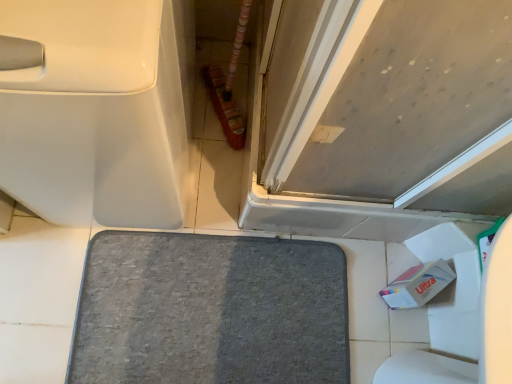
Question: Can you confirm if white glossy toilet at left is positioned to the right of gray soft carpet at center?

Choices:
 (A) yes
 (B) no

Answer: (B)

Question: Is white glossy toilet at left at the left side of gray soft carpet at center?

Choices:
 (A) yes
 (B) no

Answer: (A)

Question: Can you confirm if white glossy toilet at left is smaller than gray soft carpet at center?

Choices:
 (A) no
 (B) yes

Answer: (A)

Question: Considering the relative sizes of white glossy toilet at left and gray soft carpet at center in the image provided, is white glossy toilet at left shorter than gray soft carpet at center?

Choices:
 (A) yes
 (B) no

Answer: (B)

Question: Is white glossy toilet at left bigger than gray soft carpet at center?

Choices:
 (A) no
 (B) yes

Answer: (B)

Question: In terms of width, does gray soft carpet at center look wider or thinner when compared to matte gray door at upper right?

Choices:
 (A) wide
 (B) thin

Answer: (A)

Question: From a real-world perspective, is gray soft carpet at center physically located above or below matte gray door at upper right?

Choices:
 (A) above
 (B) below

Answer: (B)

Question: Is gray soft carpet at center to the left or to the right of matte gray door at upper right in the image?

Choices:
 (A) right
 (B) left

Answer: (B)

Question: Is gray soft carpet at center bigger or smaller than matte gray door at upper right?

Choices:
 (A) big
 (B) small

Answer: (B)

Question: Based on their positions, is gray soft carpet at center located to the left or right of white glossy toilet at left?

Choices:
 (A) left
 (B) right

Answer: (B)

Question: From the image's perspective, is gray soft carpet at center located above or below white glossy toilet at left?

Choices:
 (A) below
 (B) above

Answer: (A)

Question: Is point (280, 269) positioned closer to the camera than point (116, 150)?

Choices:
 (A) closer
 (B) farther

Answer: (B)

Question: Looking at their shapes, would you say gray soft carpet at center is wider or thinner than white glossy toilet at left?

Choices:
 (A) wide
 (B) thin

Answer: (B)

Question: Considering the positions of white glossy toilet at left and gray soft carpet at center in the image, is white glossy toilet at left bigger or smaller than gray soft carpet at center?

Choices:
 (A) small
 (B) big

Answer: (B)

Question: Considering the relative positions of white glossy toilet at left and gray soft carpet at center in the image provided, is white glossy toilet at left to the left or to the right of gray soft carpet at center?

Choices:
 (A) right
 (B) left

Answer: (B)